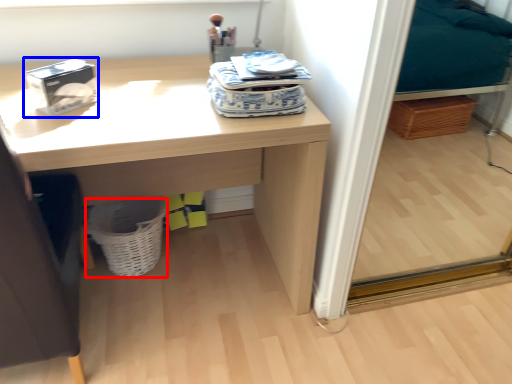
Question: Which of the following is the farthest to the observer, basket (highlighted by a red box) or box (highlighted by a blue box)?

Choices:
 (A) basket
 (B) box

Answer: (A)